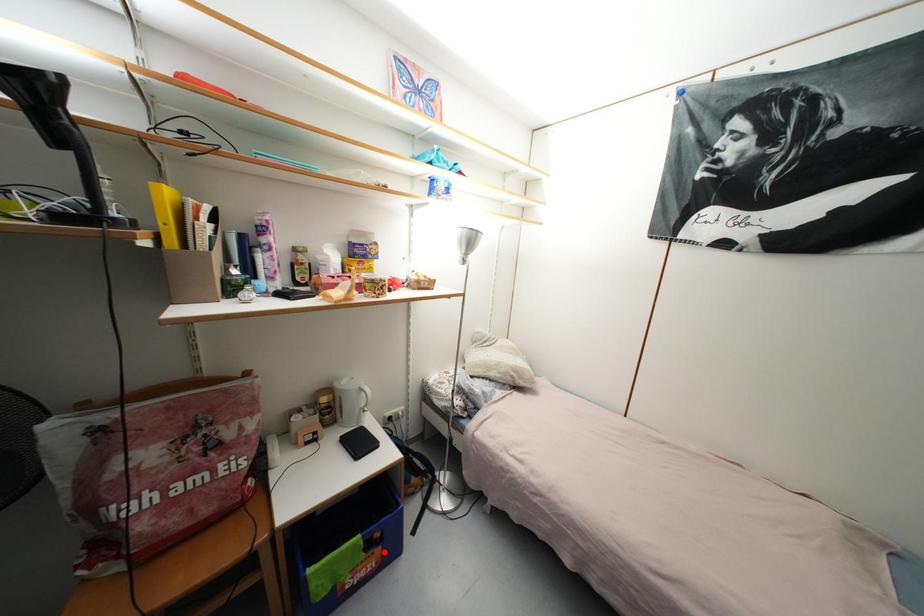
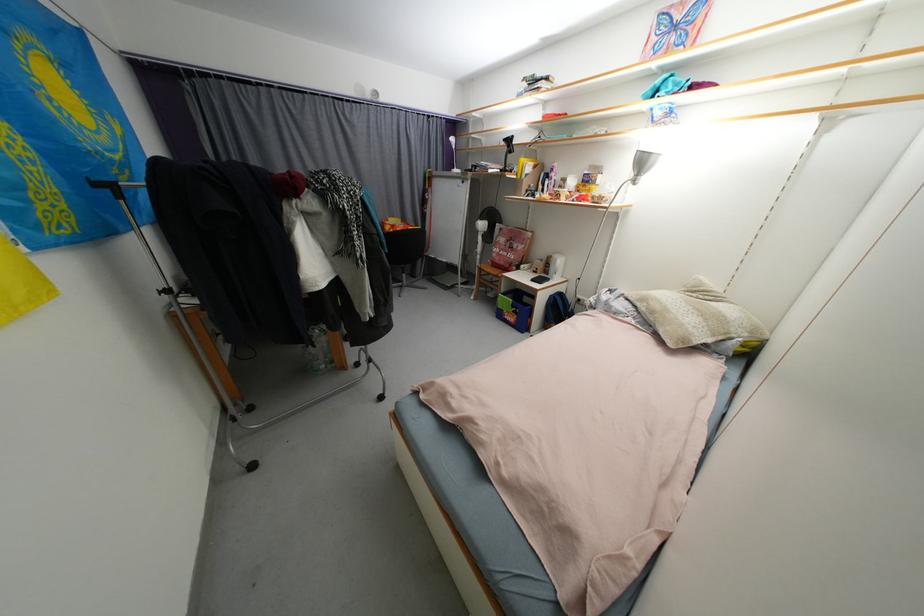
In the second image, find the point that corresponds to the highlighted location in the first image.

(520, 318)